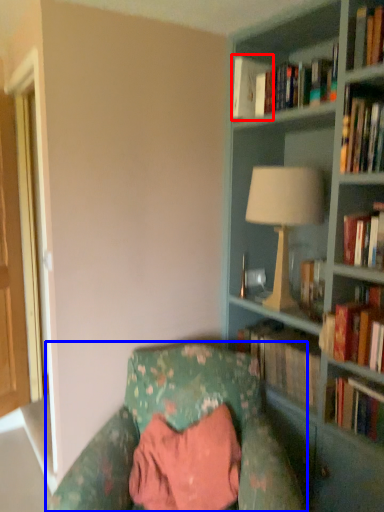
Question: Which object is further to the camera taking this photo, book (highlighted by a red box) or chair (highlighted by a blue box)?

Choices:
 (A) book
 (B) chair

Answer: (A)